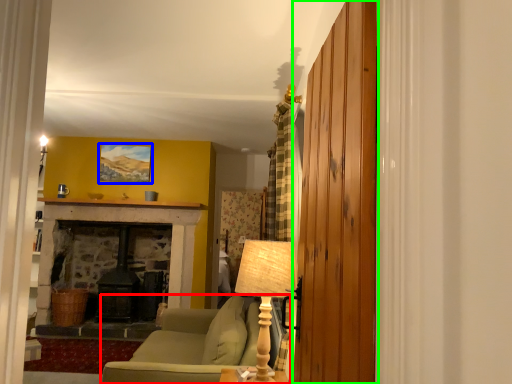
Question: Based on their relative distances, which object is nearer to studio couch (highlighted by a red box)? Choose from picture frame (highlighted by a blue box) and barn door (highlighted by a green box).

Choices:
 (A) picture frame
 (B) barn door

Answer: (B)